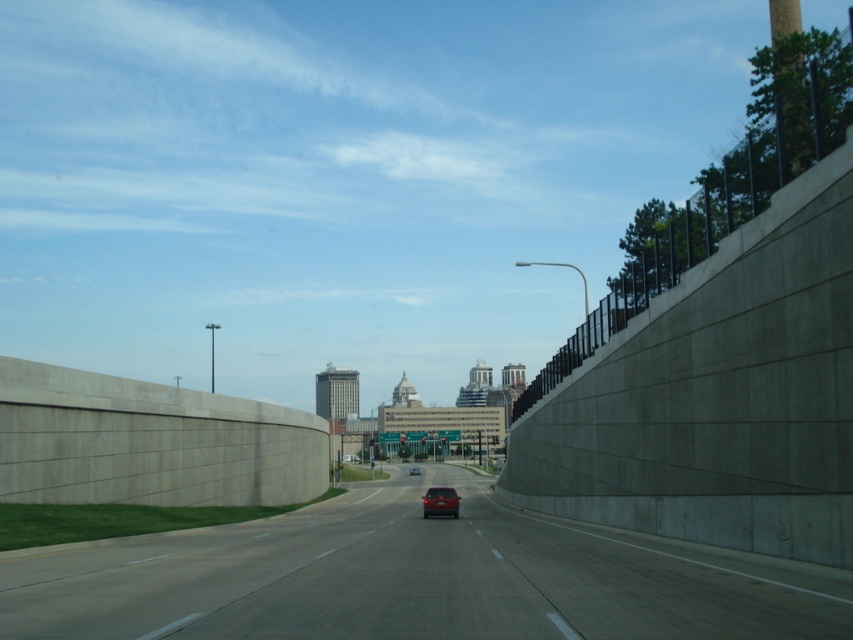
You are a delivery driver who needs to park your truck at the smooth asphalt highway at center. However, there is a no parking zone marked at point 0.905, 0.489. Can you park your truck there?

The smooth asphalt highway at center is located at point [416,579], which is the no parking zone. Therefore, you cannot park your truck there.

You are a delivery driver needing to pass through the highway. Your truck is 15 meters long. Can you safely navigate the highway if you need to pass the shiny red sedan at center while staying on the smooth asphalt highway at center?

The distance between the smooth asphalt highway at center and the shiny red sedan at center is 14.07 meters. Since your truck is 15 meters long, it is longer than the available space. Therefore, you cannot safely navigate the highway while passing the shiny red sedan at center while staying on the smooth asphalt highway at center.

You are a driver approaching the highway and see both the shiny red sedan at center and the matte red car at center. Which one is closer to you?

The shiny red sedan at center is closer to you because it is in front of the matte red car at center.